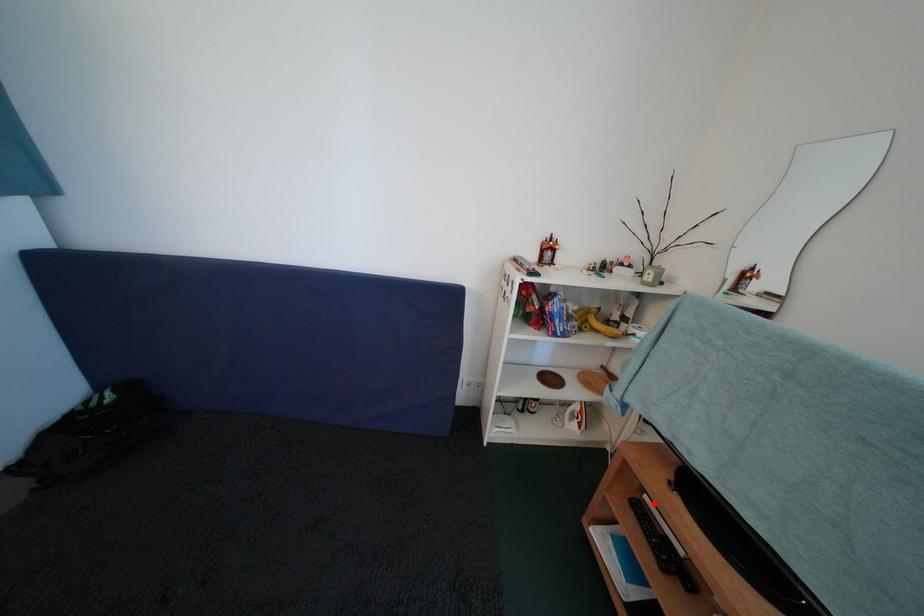
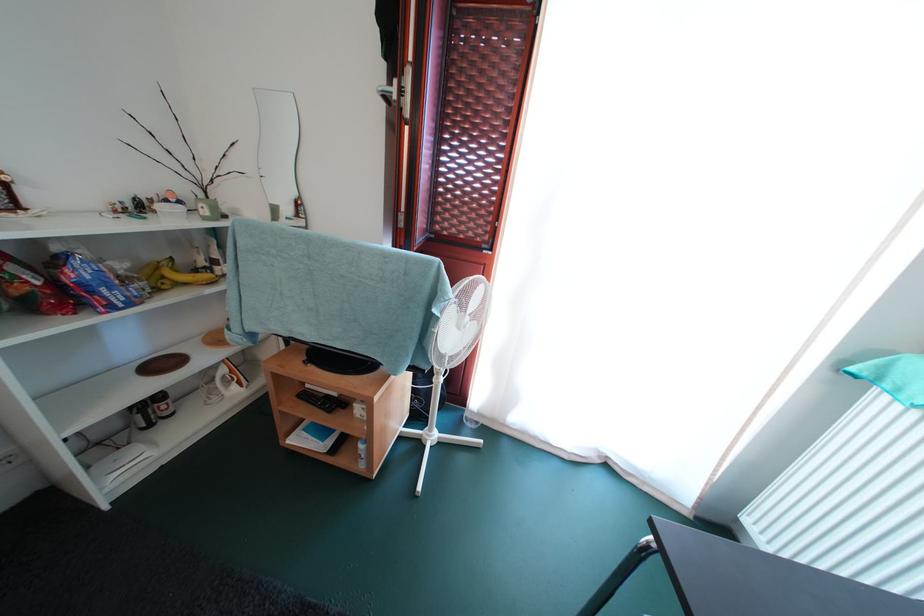
Where in the second image is the point corresponding to the highlighted location from the first image?

(314, 391)